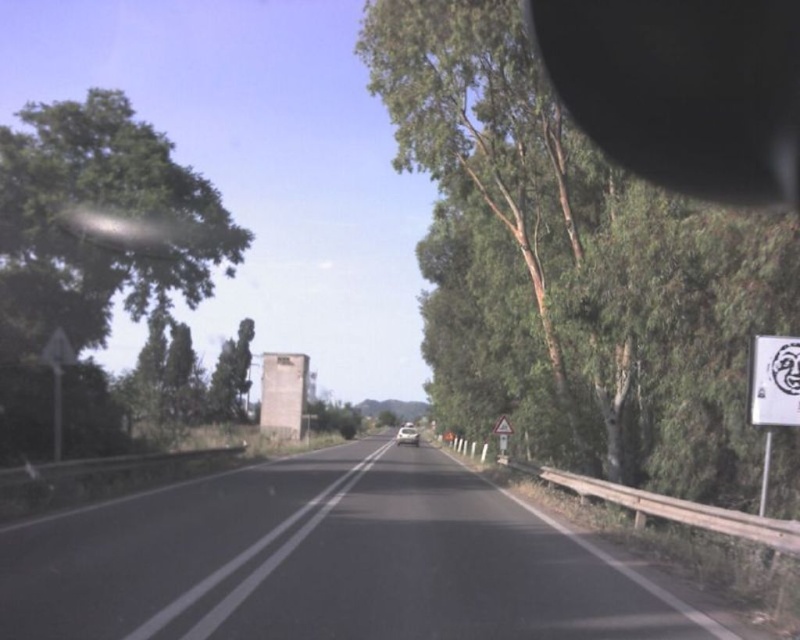
Which is more to the left, green leafy tree at right or black asphalt road at center?

black asphalt road at center

Between point (494, 326) and point (546, 550), which one is positioned behind?

Point (494, 326)

Is point (372, 77) closer to camera compared to point (580, 611)?

No.

Where is `green leafy tree at right`? This screenshot has height=640, width=800. green leafy tree at right is located at coordinates (572, 268).

Does black asphalt road at center have a lesser height compared to silver metallic car at center?

Indeed, black asphalt road at center has a lesser height compared to silver metallic car at center.

Between black asphalt road at center and silver metallic car at center, which one is positioned lower?

silver metallic car at center is lower down.

Which is behind, point (114, 611) or point (414, 432)?

The point (414, 432) is more distant.

Where is `black asphalt road at center`? This screenshot has width=800, height=640. black asphalt road at center is located at coordinates (328, 561).

Does white plastic triangle at left have a greater height compared to silver metallic car at center?

In fact, white plastic triangle at left may be shorter than silver metallic car at center.

Is white plastic triangle at left smaller than silver metallic car at center?

Yes.

The height and width of the screenshot is (640, 800). I want to click on white plastic triangle at left, so click(x=57, y=378).

Find the location of a particular element. Image resolution: width=800 pixels, height=640 pixels. white plastic triangle at left is located at coordinates (57, 378).